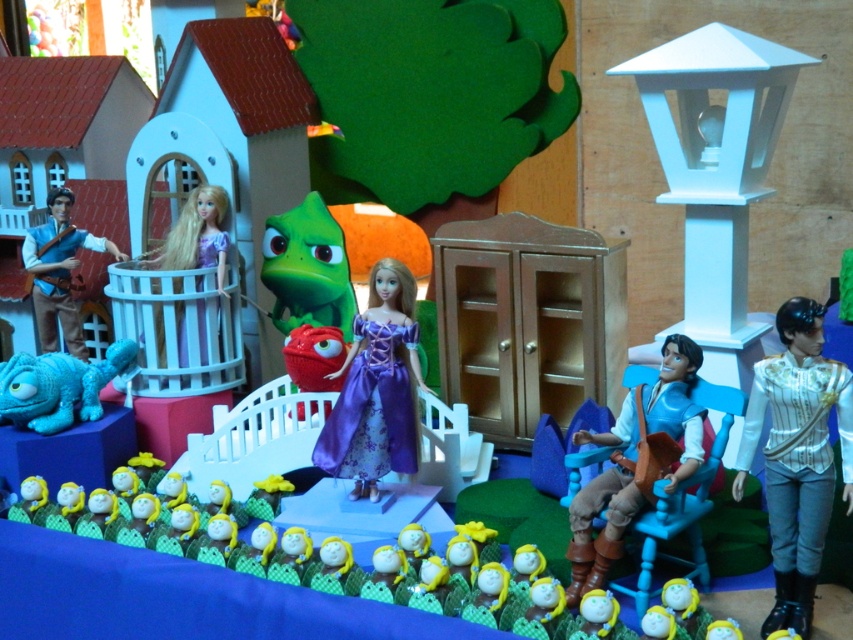
You are a character in the fairy tale scene. You need to decide which clothing item is taller between the brown leather vest at center right and the matte purple dress at center. Which one is taller?

The brown leather vest at center right is taller than the matte purple dress at center.

You are a designer trying to place a golden crown exactly at the dragon creature in the center. The dragon is positioned at point 0.608, 0.442. Can you confirm if the purple satin dress at center is also at the same coordinates?

The purple satin dress at center is located at point (x=376, y=388), so yes, it shares the same coordinates as the dragon creature in the center.